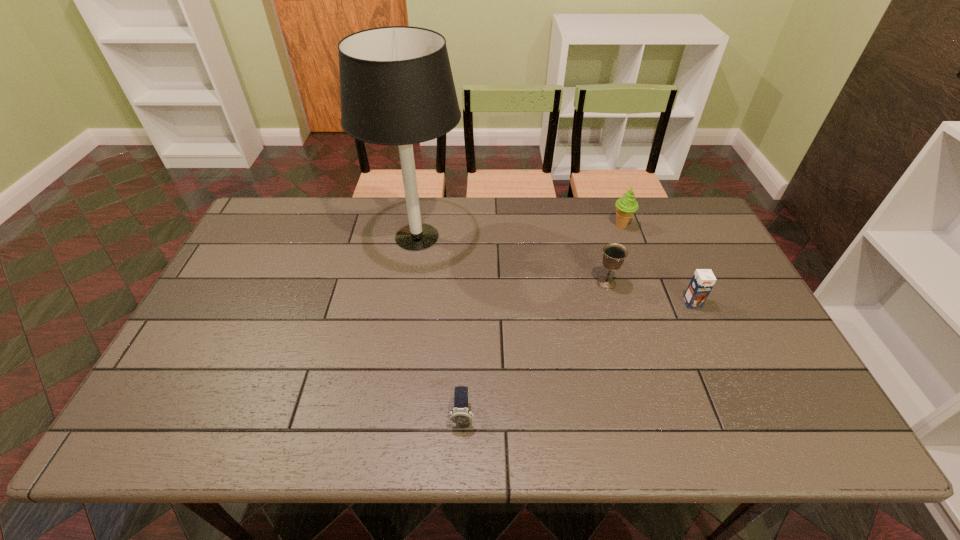
You are a GUI agent. You are given a task and a screenshot of the screen. Output one action in this format:
    pyautogui.click(x=<x>, y=<y>)
    Task: Click on the free space located on the front of the fourth shortest object
    Image resolution: width=960 pixels, height=540 pixels.
    Given the screenshot: What is the action you would take?
    pyautogui.click(x=635, y=262)

Locate an element on the screen. The width and height of the screenshot is (960, 540). free space located 0.160m on the right of the third object from left to right is located at coordinates (673, 284).

Locate an element on the screen. free space located 0.220m on the front label of the fourth farthest object is located at coordinates (726, 377).

Where is `table lamp that is at the far edge`? table lamp that is at the far edge is located at coordinates (396, 85).

Find the location of a particular element. icecream at the far edge is located at coordinates (625, 206).

Where is `object that is at the near edge`? object that is at the near edge is located at coordinates (460, 414).

Locate an element on the screen. Image resolution: width=960 pixels, height=540 pixels. object at the right edge is located at coordinates (703, 280).

This screenshot has width=960, height=540. I want to click on vacant space at the far edge of the desktop, so click(x=370, y=217).

Locate an element on the screen. Image resolution: width=960 pixels, height=540 pixels. vacant space at the near edge of the desktop is located at coordinates (556, 442).

The height and width of the screenshot is (540, 960). In the image, there is a desktop. Find the location of `vacant area at the left edge`. vacant area at the left edge is located at coordinates (256, 303).